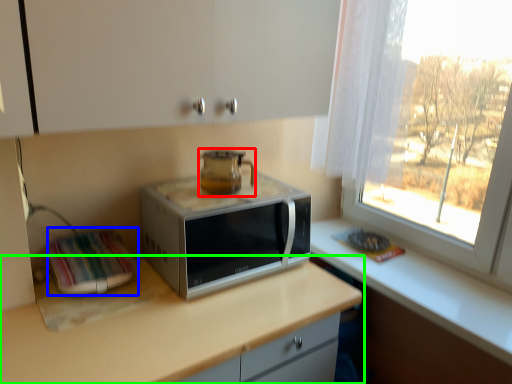
Question: Based on their relative distances, which object is farther from home appliance (highlighted by a red box)? Choose from appliance (highlighted by a blue box) and countertop (highlighted by a green box).

Choices:
 (A) appliance
 (B) countertop

Answer: (B)